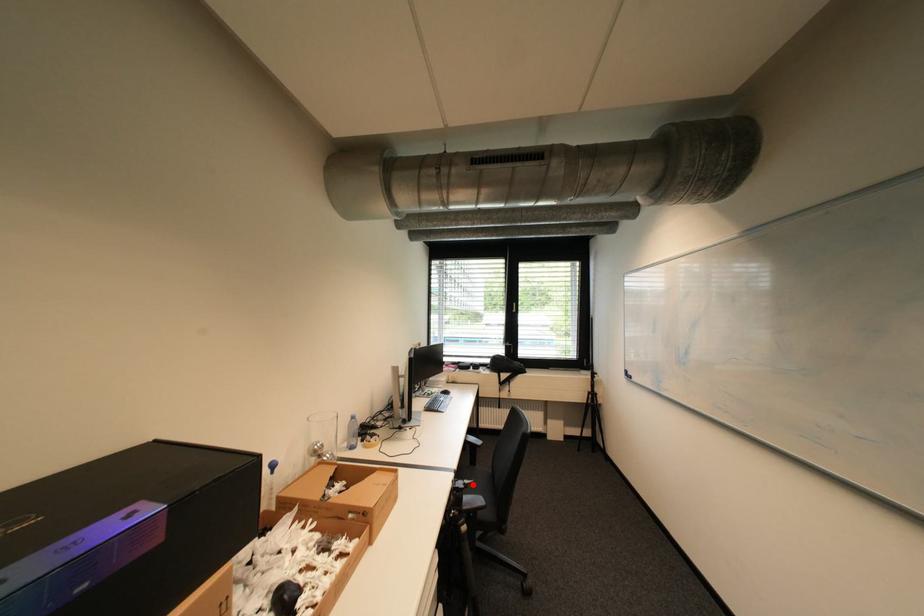
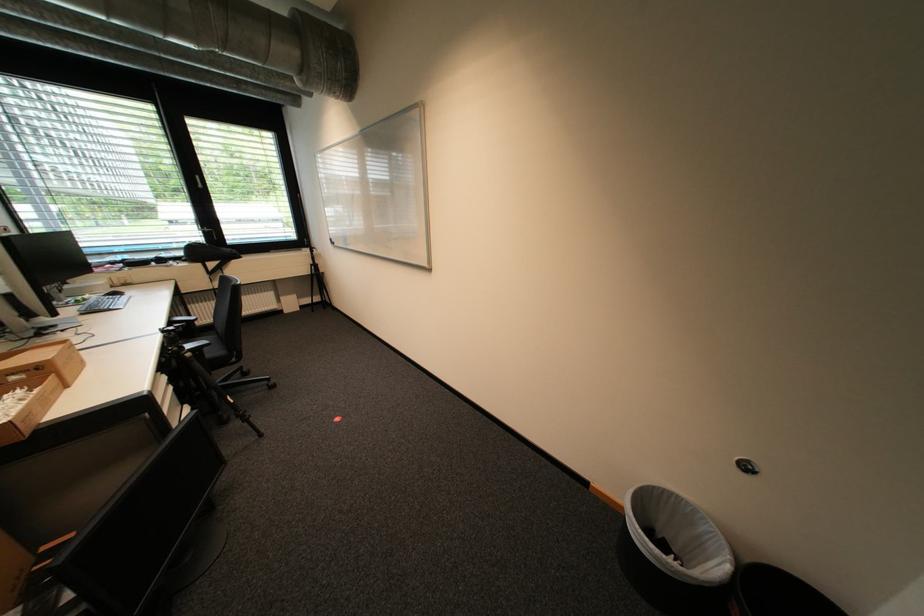
Find the pixel in the second image that matches the highlighted location in the first image.

(184, 328)